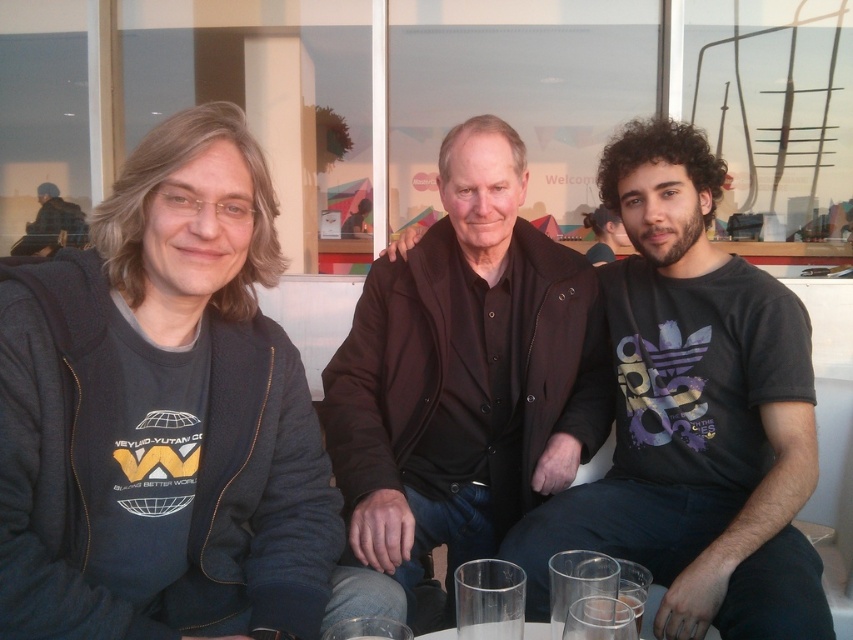
Is dark gray hoodie at left positioned at the back of black matte t-shirt at right?

No, it is not.

Locate an element on the screen. dark gray hoodie at left is located at coordinates (167, 419).

At what (x,y) coordinates should I click in order to perform the action: click on dark gray hoodie at left. Please return your answer as a coordinate pair (x, y). Looking at the image, I should click on (167, 419).

Is black matte t-shirt at right positioned in front of transparent glass at lower center?

No, black matte t-shirt at right is behind transparent glass at lower center.

Between point (749, 461) and point (482, 632), which one is positioned in front?

Point (482, 632)

Identify the location of black matte t-shirt at right. (694, 413).

Is point (720, 572) farther from viewer compared to point (61, 204)?

No, (720, 572) is in front of (61, 204).

Does black matte t-shirt at right appear over dark blue uniform at left?

No.

Identify the location of black matte t-shirt at right. point(694,413).

Locate an element on the screen. The width and height of the screenshot is (853, 640). black matte t-shirt at right is located at coordinates (694, 413).